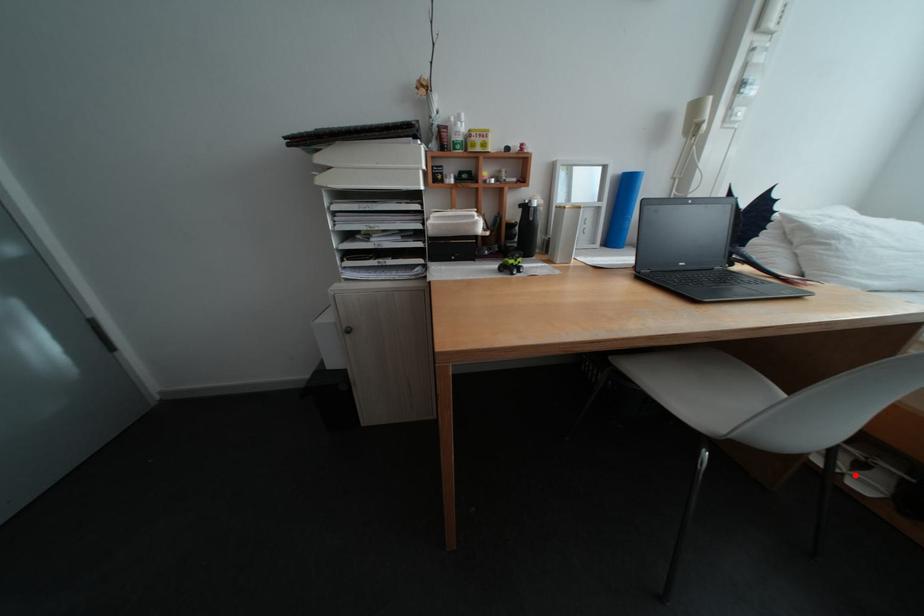
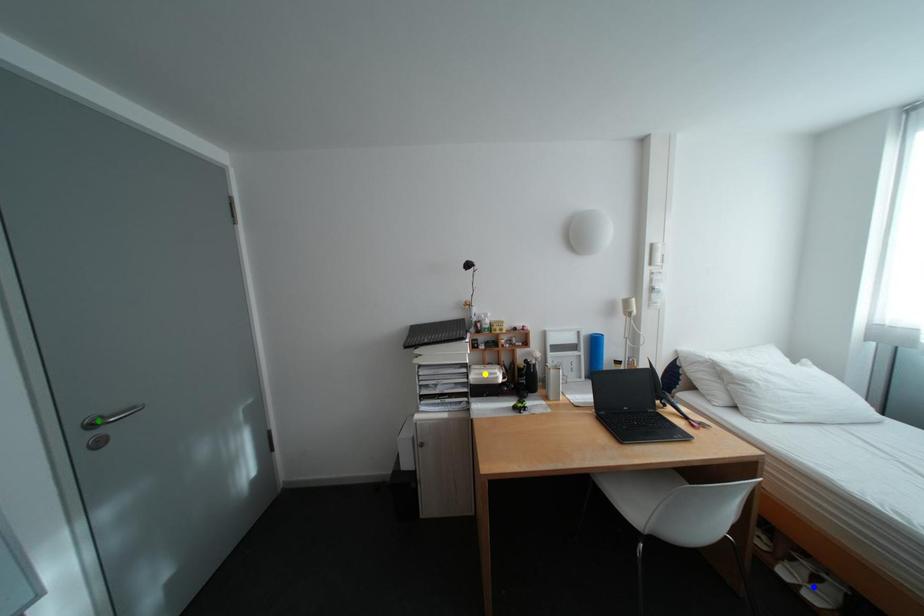
Question: I am providing you with two images of the same scene from different viewpoints. A red point is marked on the first image. You are given multiple points on the second image. Which mark in image 2 goes with the point in image 1?

Choices:
 (A) yellow point
 (B) green point
 (C) blue point

Answer: (C)